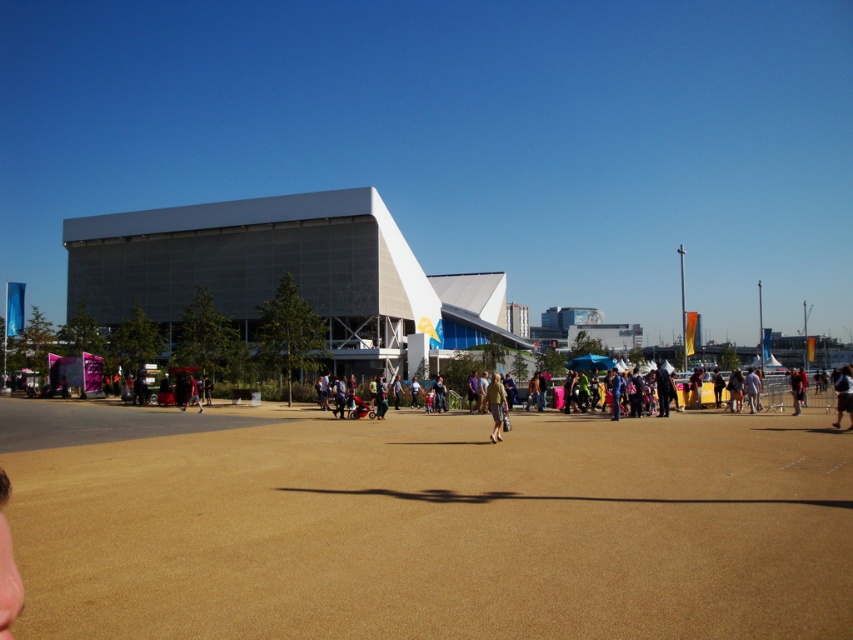
You are standing on the paved area and want to walk towards the dark blue jeans at lower right. Will the brown textured dirt field at center be in your path?

The brown textured dirt field at center is closer to the viewer than the dark blue jeans at lower right, so it will be in your path as you walk towards the dark blue jeans at lower right.

Based on the photo, you are standing at the edge of the paved area and want to take a photo of both the gray metallic building at center and the khaki fabric pants at center. Which object should you focus on first to ensure both are in clear view?

You should focus on the gray metallic building at center first because it is closer to you than the khaki fabric pants at center, ensuring both are in clear view.